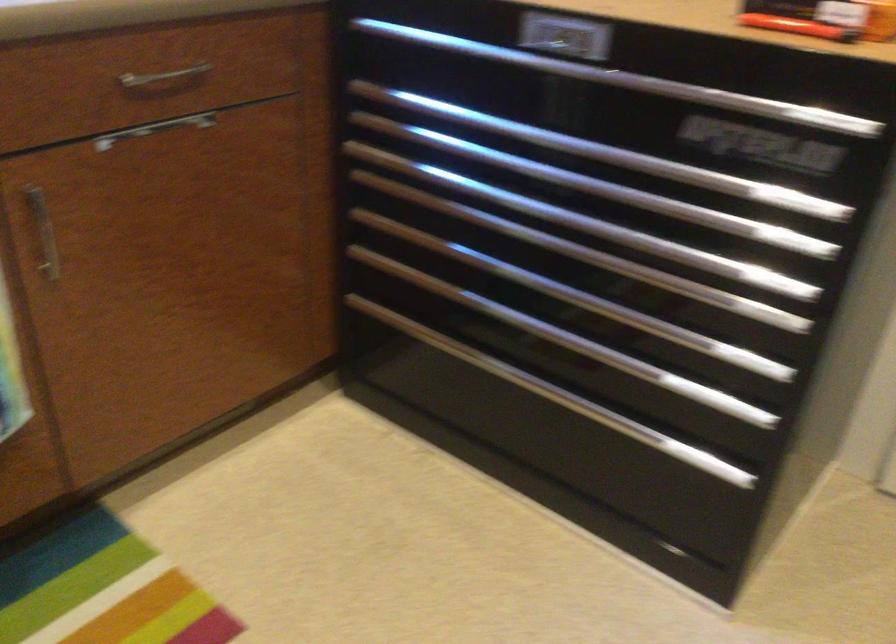
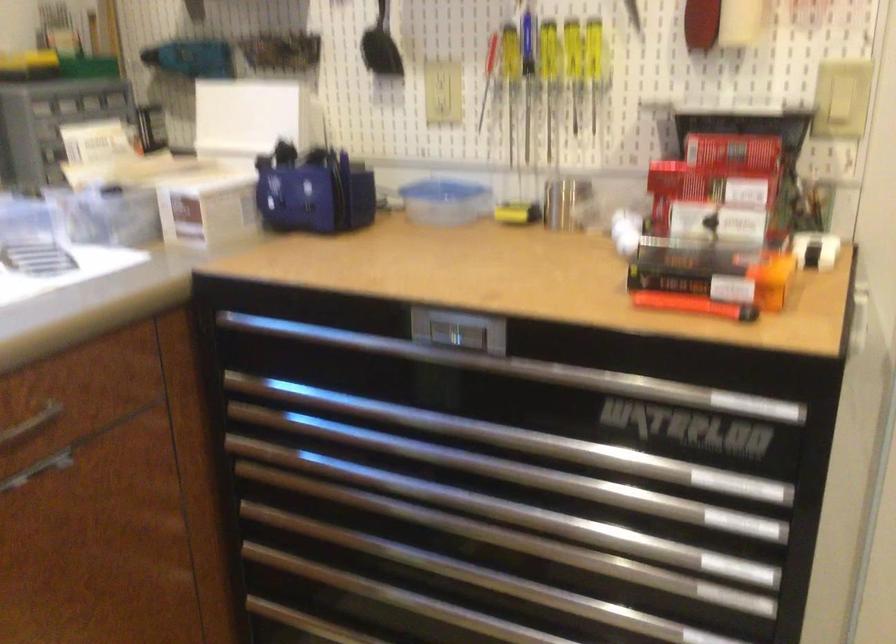
Question: The camera is either moving clockwise (left) or counter-clockwise (right) around the object. The first image is from the beginning of the video and the second image is from the end. Is the camera moving left or right when shooting the video?

Choices:
 (A) Left
 (B) Right

Answer: (A)